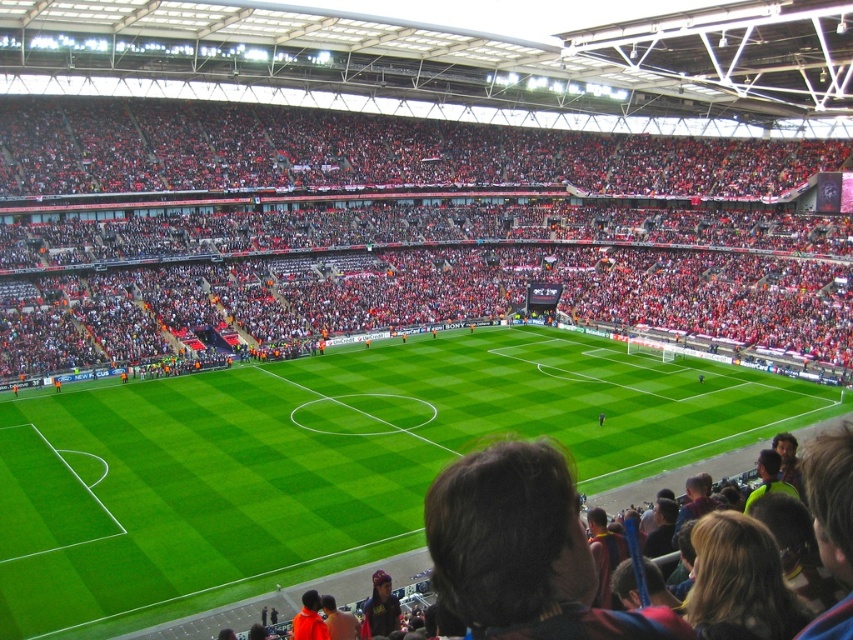
Image resolution: width=853 pixels, height=640 pixels. What do you see at coordinates (396, 230) in the screenshot?
I see `red fabric seats at center` at bounding box center [396, 230].

What do you see at coordinates (396, 230) in the screenshot? I see `red fabric seats at center` at bounding box center [396, 230].

This screenshot has width=853, height=640. I want to click on red fabric seats at center, so click(396, 230).